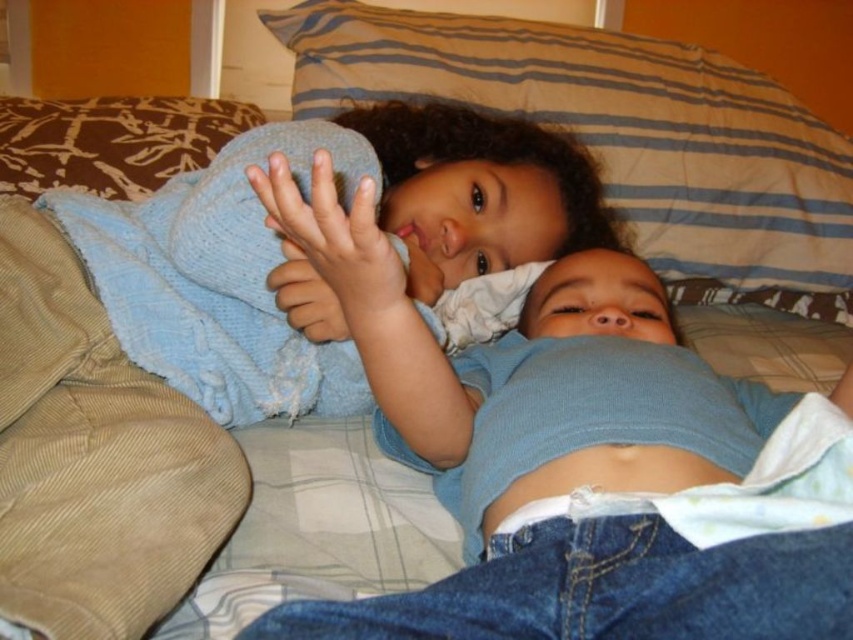
Does blue cotton shirt at center appear over brown textured pillow at upper left?

No.

Is point (648, 337) less distant than point (59, 113)?

That is True.

Where is `blue cotton shirt at center`? The width and height of the screenshot is (853, 640). blue cotton shirt at center is located at coordinates (541, 387).

Is striped fabric pillow at upper center below brown textured pillow at upper left?

No.

Identify the location of striped fabric pillow at upper center. The image size is (853, 640). (614, 129).

What do you see at coordinates (614, 129) in the screenshot?
I see `striped fabric pillow at upper center` at bounding box center [614, 129].

The width and height of the screenshot is (853, 640). I want to click on striped fabric pillow at upper center, so click(614, 129).

Does blue cotton shirt at center appear on the left side of striped fabric pillow at upper center?

Yes, blue cotton shirt at center is to the left of striped fabric pillow at upper center.

Is point (314, 188) in front of point (683, 64)?

Yes, point (314, 188) is closer to viewer.

The height and width of the screenshot is (640, 853). Identify the location of blue cotton shirt at center. (541, 387).